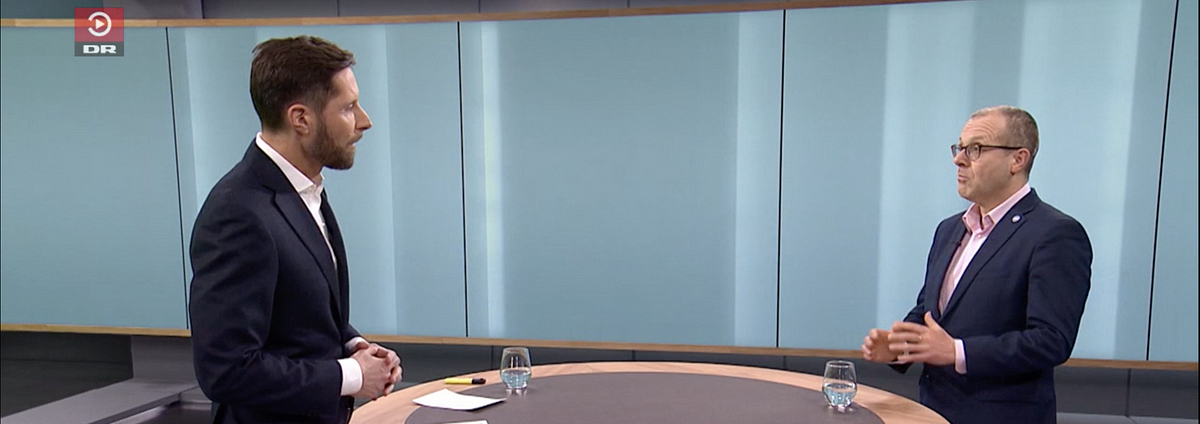
This screenshot has width=1200, height=424. Find the location of `table`. table is located at coordinates (602, 395).